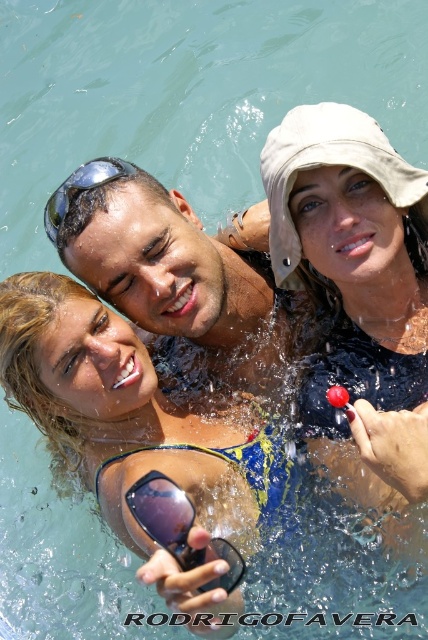
You are standing at the origin of the coordinate system in the image. You want to reach point B located at point [193,520] first before moving to point A at [163,259]. Which direction should you move first from your starting position?

Since point [163,259] is behind point [193,520], you should first move towards point [193,520] in the direction of point B before going to point A.

Looking at this image, based on the scene description, where is the matte skin at center located in the image?

The matte skin at center is located at point coordinates of 0.423 on the x axis and 0.402 on the y axis.